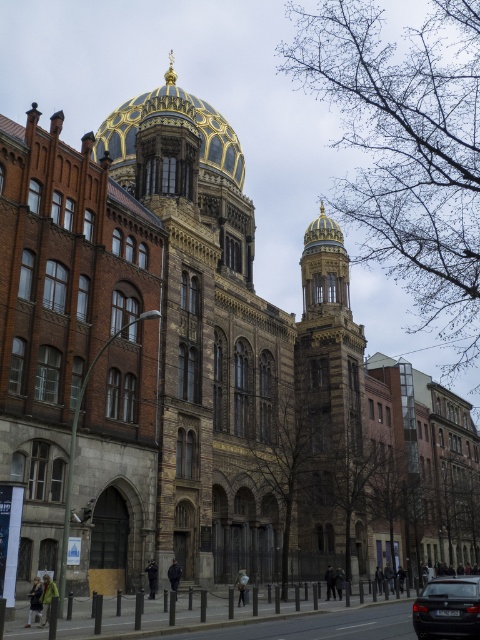
Question: Which object appears farthest from the camera in this image?

Choices:
 (A) goldmatte/goldendome at upper center
 (B) gold mosaic dome at upper center
 (C) black glossy car at lower right

Answer: (A)

Question: Does gold mosaic dome at upper center have a larger size compared to goldmatte/goldendome at upper center?

Choices:
 (A) yes
 (B) no

Answer: (A)

Question: Does black glossy car at lower right lie behind goldmatte/goldendome at upper center?

Choices:
 (A) no
 (B) yes

Answer: (A)

Question: Which object is closer to the camera taking this photo?

Choices:
 (A) goldmatte/goldendome at upper center
 (B) gold mosaic dome at upper center

Answer: (B)

Question: Which is farther from the black glossy car at lower right?

Choices:
 (A) gold mosaic dome at upper center
 (B) goldmatte/goldendome at upper center

Answer: (A)

Question: Can you confirm if gold mosaic dome at upper center is bigger than black glossy car at lower right?

Choices:
 (A) no
 (B) yes

Answer: (B)